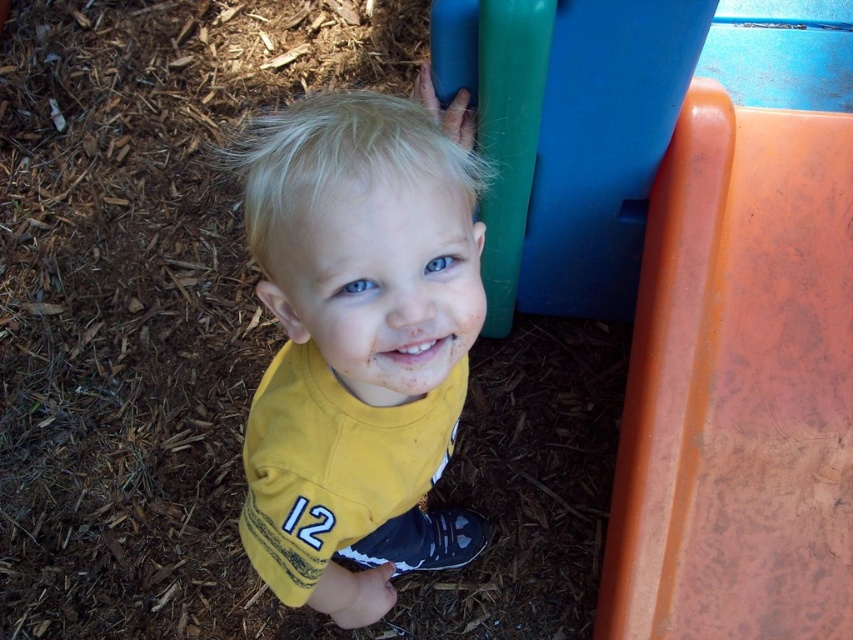
Question: Where is orange matte slide at right located in relation to yellow fabric shirt at center in the image?

Choices:
 (A) below
 (B) above

Answer: (A)

Question: Among these points, which one is farthest from the camera?

Choices:
 (A) (682, 589)
 (B) (340, 349)

Answer: (A)

Question: Among these points, which one is nearest to the camera?

Choices:
 (A) (665, 218)
 (B) (434, 243)

Answer: (B)

Question: Which of the following is the farthest from the observer?

Choices:
 (A) (772, 419)
 (B) (468, 520)

Answer: (B)

Question: Does orange matte slide at right lie in front of yellow fabric shirt at center?

Choices:
 (A) yes
 (B) no

Answer: (B)

Question: Is orange matte slide at right to the right of yellow fabric shirt at center from the viewer's perspective?

Choices:
 (A) yes
 (B) no

Answer: (A)